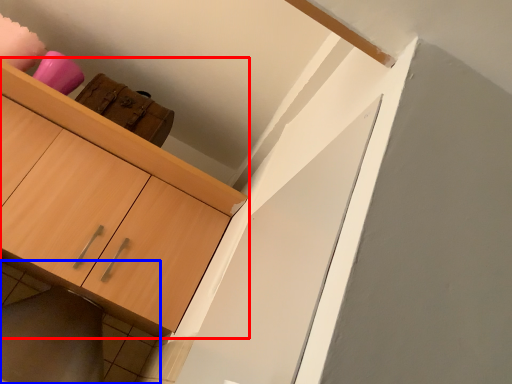
Question: Which of the following is the farthest to the observer, cabinetry (highlighted by a red box) or tile (highlighted by a blue box)?

Choices:
 (A) cabinetry
 (B) tile

Answer: (B)